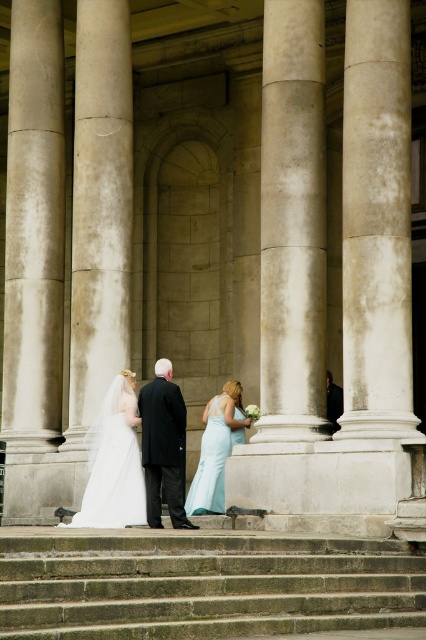
Question: Observing the image, what is the correct spatial positioning of white marble column at right in reference to dark gray suit at center?

Choices:
 (A) left
 (B) right

Answer: (B)

Question: Which point is farther to the camera?

Choices:
 (A) (304, 116)
 (B) (173, 401)

Answer: (A)

Question: Which object is positioned closest to the white satin dress at lower left?

Choices:
 (A) white marble column at left
 (B) light blue satin dress at center

Answer: (B)

Question: Is white marble column at left smaller than white marble pillar at center?

Choices:
 (A) yes
 (B) no

Answer: (A)

Question: Which object is closer to the camera taking this photo?

Choices:
 (A) white marble column at right
 (B) dark gray suit at center
 (C) white marble pillar at center

Answer: (A)

Question: Is white marble pillar at center closer to camera compared to white satin dress at center?

Choices:
 (A) yes
 (B) no

Answer: (B)